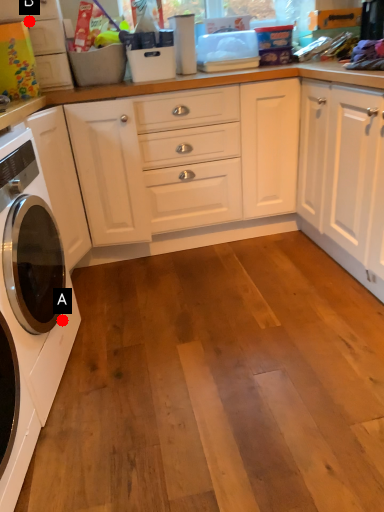
Question: Two points are circled on the image, labeled by A and B beside each circle. Which point is farther from the camera taking this photo?

Choices:
 (A) A is further
 (B) B is further

Answer: (B)